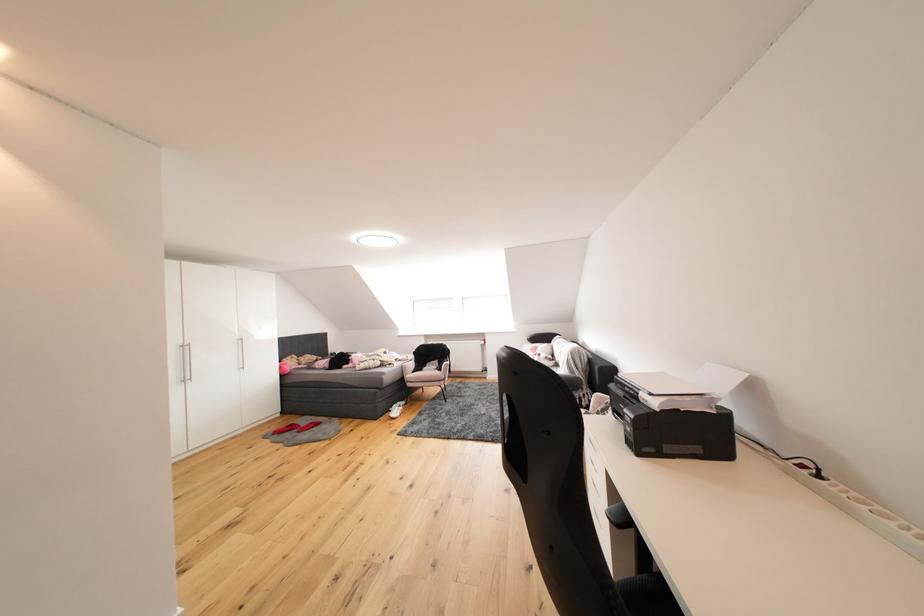
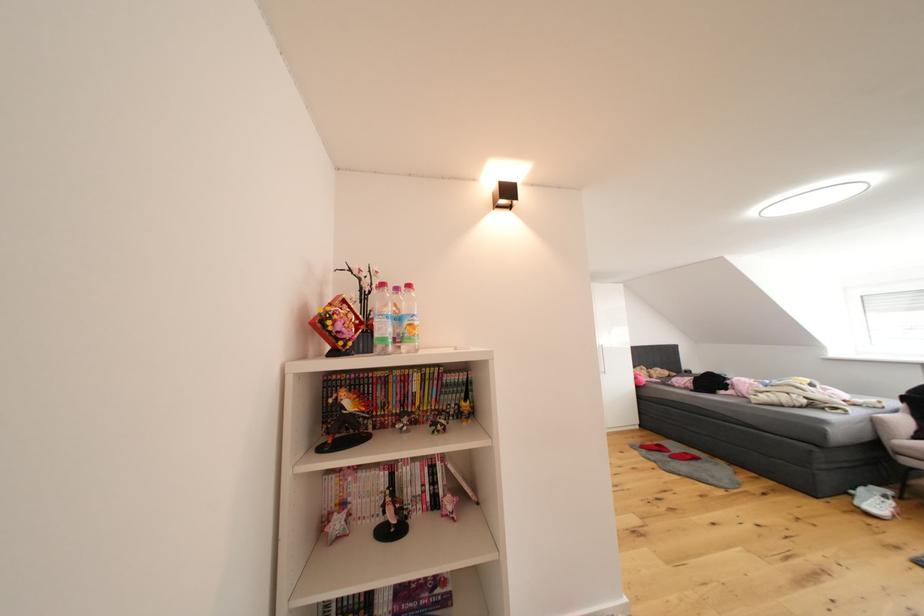
Question: How did the camera likely rotate?

Choices:
 (A) Left
 (B) Right
 (C) Up
 (D) Down

Answer: (A)